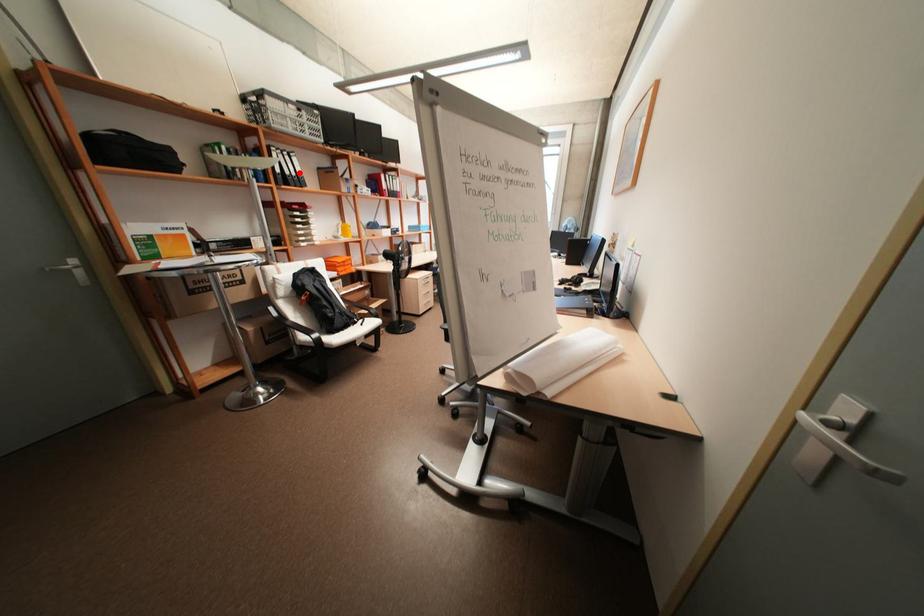
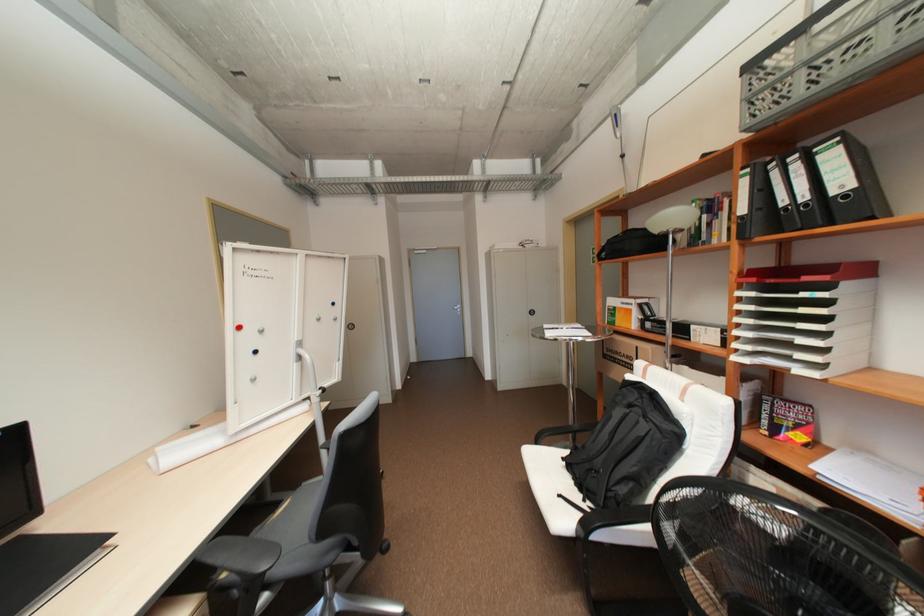
Where in the second image is the point corresponding to the highlighted location from the first image?

(810, 197)